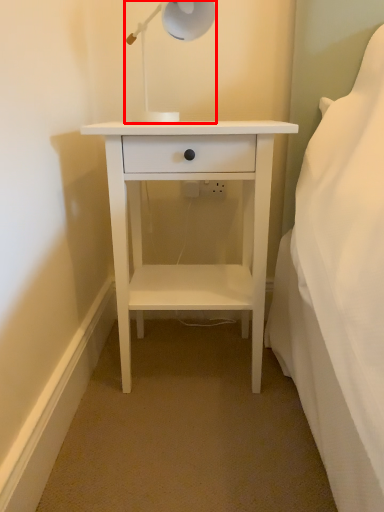
Question: Observing the image, what is the correct spatial positioning of lamp (annotated by the red box) in reference to nightstand?

Choices:
 (A) left
 (B) right

Answer: (A)